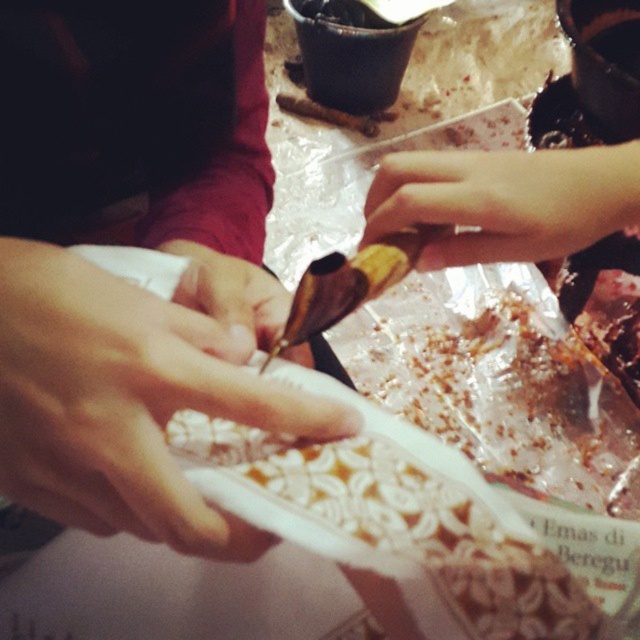
Question: Does white matte plate at center appear under smooth skin at center?

Choices:
 (A) no
 (B) yes

Answer: (B)

Question: Can you confirm if white matte plate at center is bigger than pale skin at upper right?

Choices:
 (A) no
 (B) yes

Answer: (B)

Question: Which object appears closest to the camera in this image?

Choices:
 (A) pale skin at upper right
 (B) white matte plate at center
 (C) smooth skin at center

Answer: (B)

Question: Which is farther from the smooth skin at center?

Choices:
 (A) white matte plate at center
 (B) pale skin at upper right

Answer: (B)

Question: Does pale skin at upper right appear on the left side of smooth skin at center?

Choices:
 (A) yes
 (B) no

Answer: (B)

Question: Which point is closer to the camera taking this photo?

Choices:
 (A) (42, 476)
 (B) (445, 170)
 (C) (268, 310)

Answer: (A)